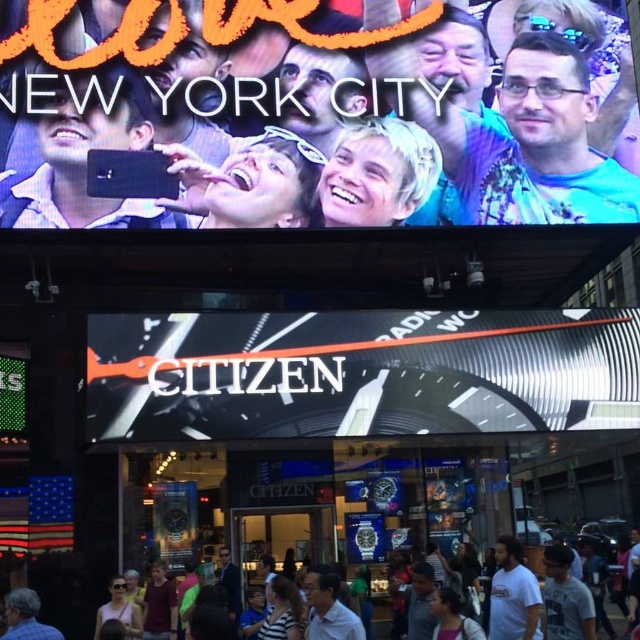
Question: Which of these objects is positioned closest to the blue denim jeans at lower left?

Choices:
 (A) gray cotton t-shirt at lower center
 (B) white metallic watch at center
 (C) multicolored casual attire at lower center

Answer: (C)

Question: Does gray cotton t-shirt at lower center appear on the left side of multicolored casual attire at lower center?

Choices:
 (A) no
 (B) yes

Answer: (A)

Question: Which of the following is the farthest from the observer?

Choices:
 (A) pos(465,369)
 (B) pos(566,556)

Answer: (A)

Question: Observing the image, what is the correct spatial positioning of white cotton t-shirt at lower right in reference to multicolored casual attire at lower center?

Choices:
 (A) above
 (B) below

Answer: (A)

Question: Does matte black phone at upper center have a lesser width compared to gray cotton t-shirt at lower center?

Choices:
 (A) yes
 (B) no

Answer: (B)

Question: Which is nearer to the matte black phone at upper center?

Choices:
 (A) multicolored casual attire at lower center
 (B) white metallic watch at center

Answer: (B)